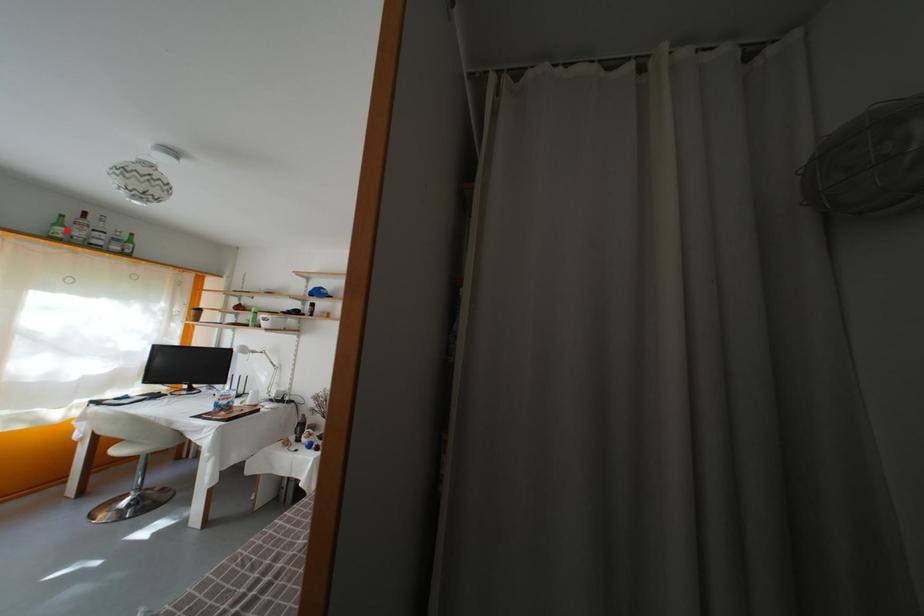
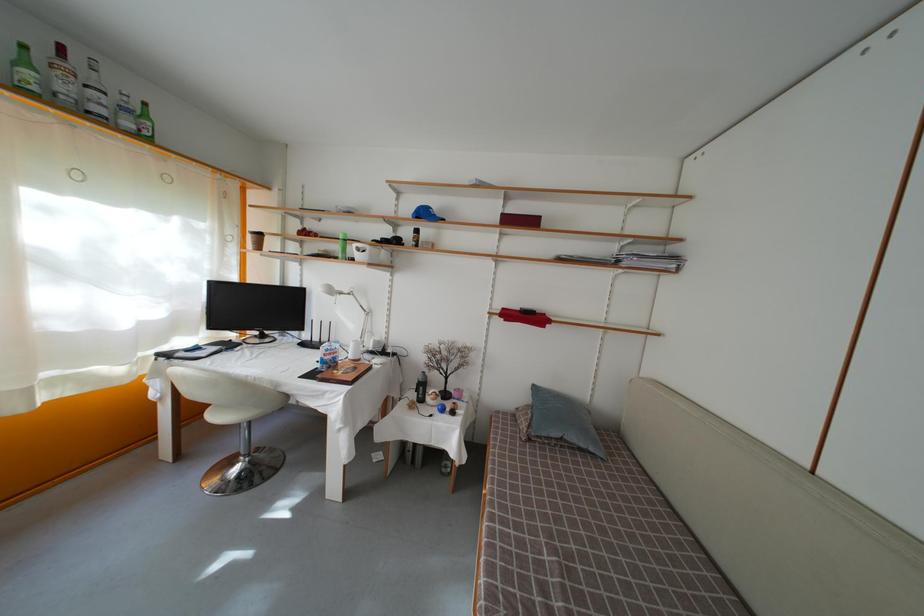
Where in the second image is the point corresponding to the highlighted location from the first image?

(31, 69)